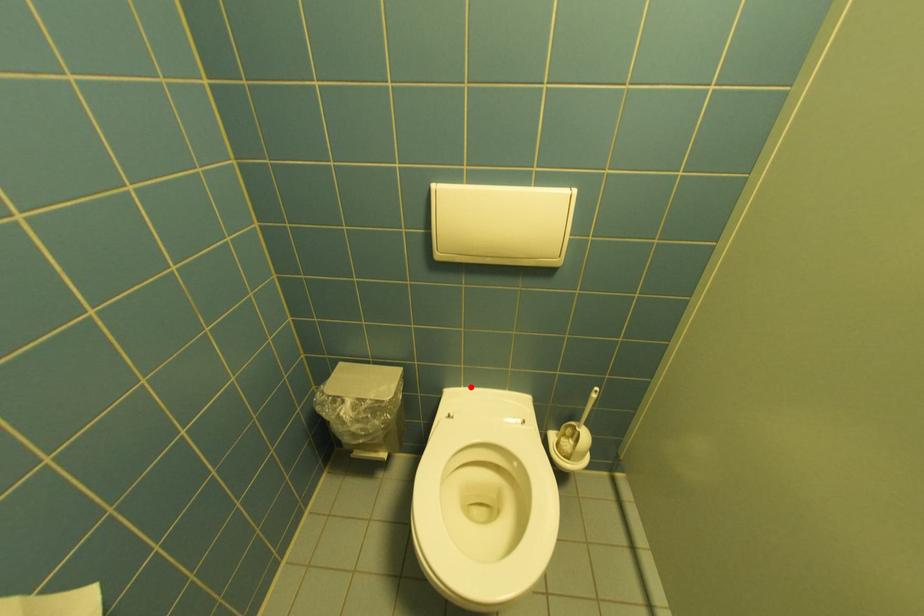
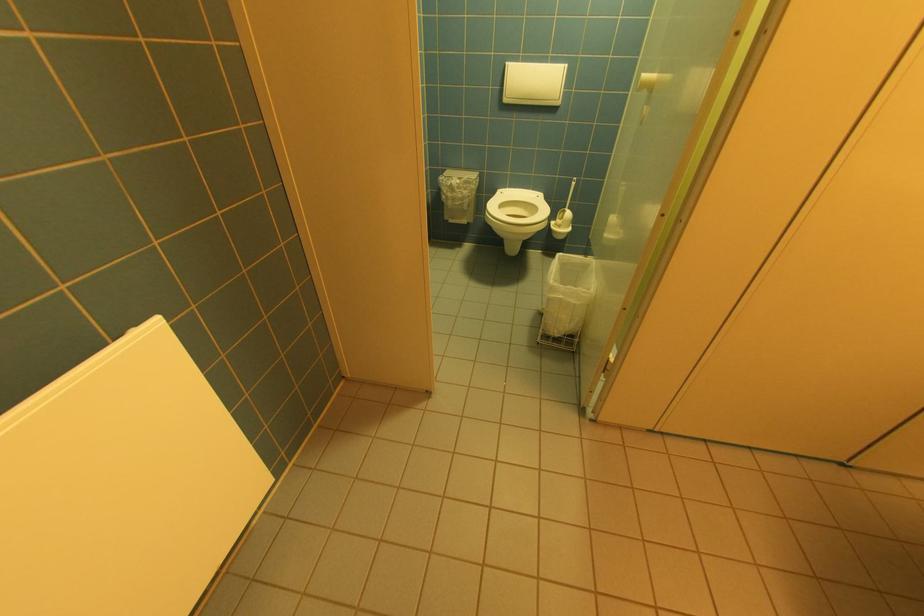
Locate, in the second image, the point that corresponds to the highlighted location in the first image.

(515, 188)